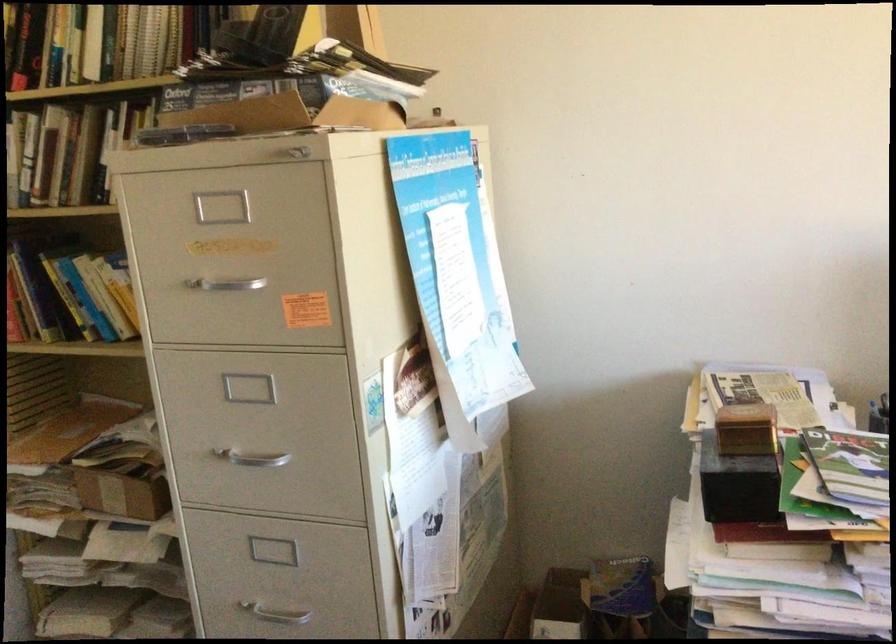
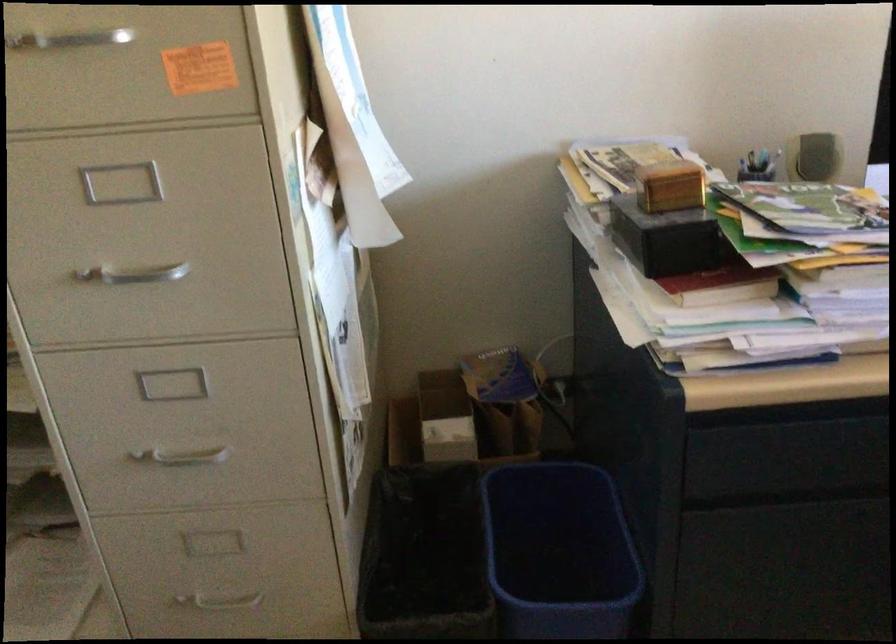
Find the pixel in the second image that matches point (254, 460) in the first image.

(134, 274)